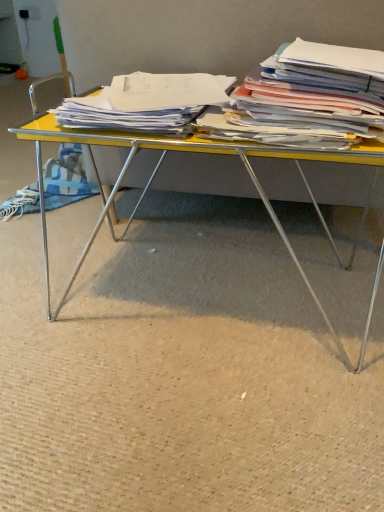
Locate an element on the screen. vacant space behind yellow plastic desk at center is located at coordinates (209, 218).